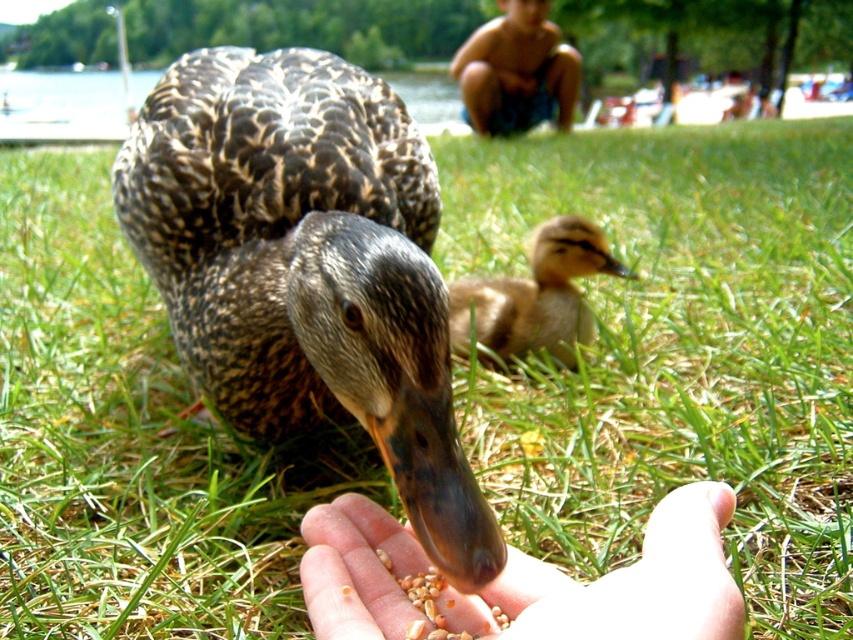
You are a photographer trying to capture a closeup shot of the brown speckled duck at center and the blurred skin boy at upper center. Given that your camera can only focus on subjects within 10 feet, will you be able to get a clear photo of both subjects?

The brown speckled duck at center is 16.62 feet away from the blurred skin boy at upper center. Since the camera can only focus on subjects within 10 feet, the distance between them is greater than the camera can handle. Therefore, you won

You are a small duckling in the scene. To reach the food being offered by the skinny human hand at center, in which direction should you move from your current position?

The skinny human hand at center is located at point (x=622, y=582), so you should move towards the lower right direction to reach it.